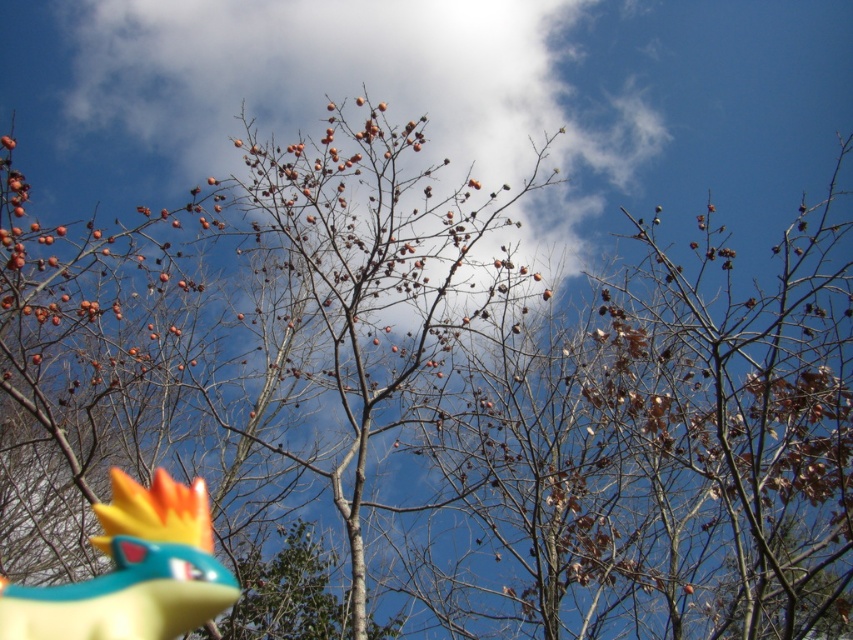
You are an astronomer analyzing the image. You notice a point marked at coordinates (338, 92). What object is located at that point?

The point at coordinates (338, 92) marks the white fluffy cloud at upper center.

You are a bird flying over the scene. You see the white fluffy cloud at upper center and the yellow rubber toy at lower left. Which object is higher in the sky?

The white fluffy cloud at upper center is higher in the sky than the yellow rubber toy at lower left because it is positioned above it.